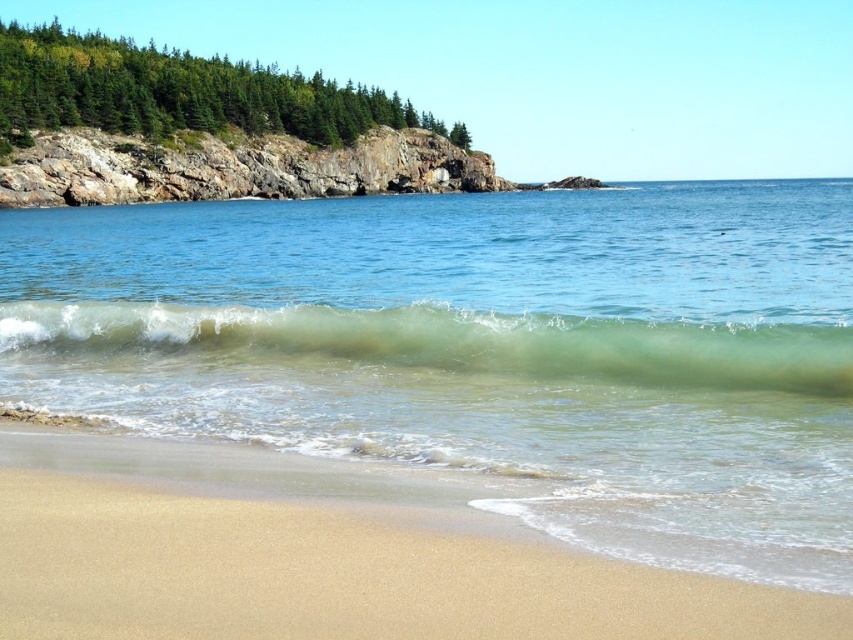
You are standing on the beach and notice the clear water at center and the green translucent wave at center. Which one is closer to the shore?

The green translucent wave at center is closer to the shore because it is positioned under the clear water at center.

You are standing at the point with coordinates (x=320, y=556) in the image. Based on the scene description, what feature of the coastal landscape are you most likely standing on?

The point at (x=320, y=556) corresponds to the sandy beach at lower left, so you are most likely standing on the sandy beach at lower left.

You are standing on the sandy beach at lower left and want to reach the clear water at center. Which direction should you move to get there?

You should move upward because the clear water at center is above the sandy beach at lower left.